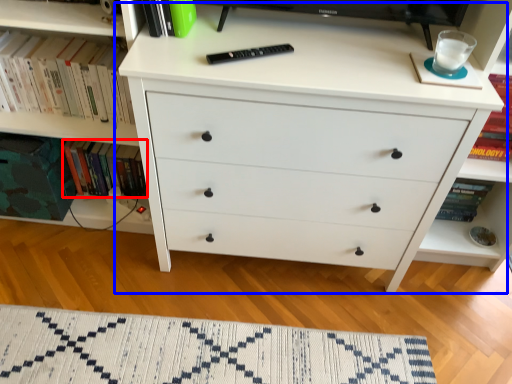
Question: Among these objects, which one is nearest to the camera, book (highlighted by a red box) or chest of drawers (highlighted by a blue box)?

Choices:
 (A) book
 (B) chest of drawers

Answer: (B)